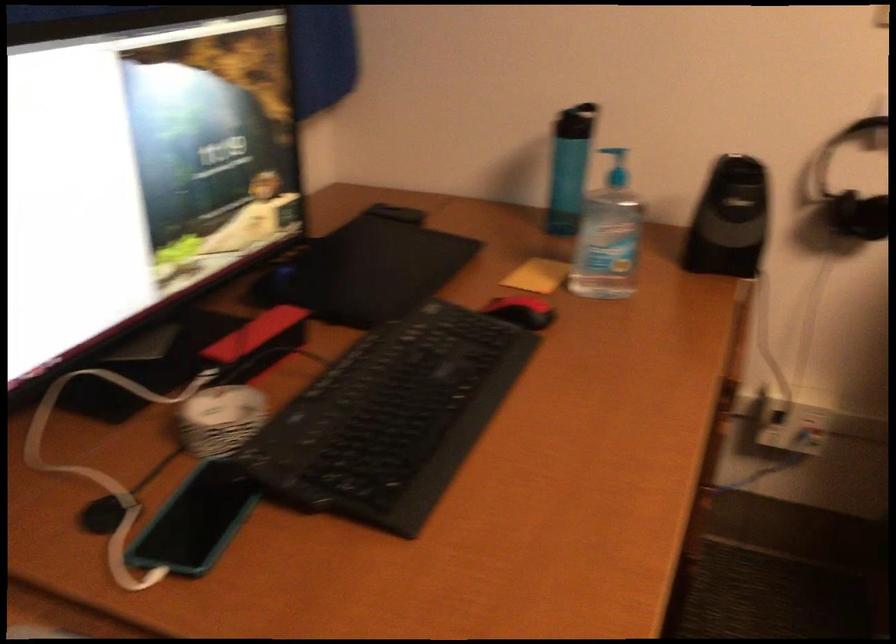
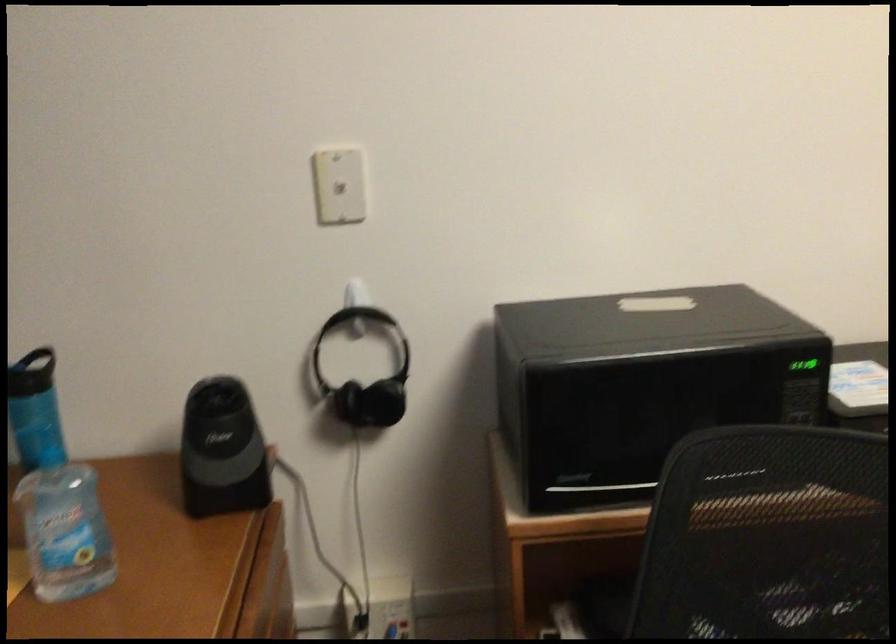
Question: The images are taken continuously from a first-person perspective. In which direction is your viewpoint rotating?

Choices:
 (A) Left
 (B) Right
 (C) Up
 (D) Down

Answer: (B)